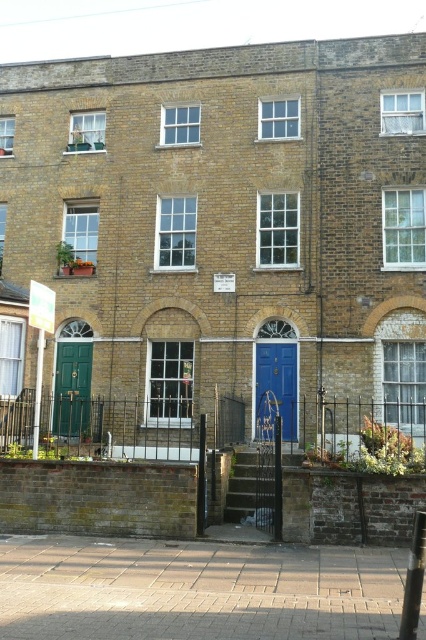
Can you confirm if green matte door at center-left is thinner than blue glossy door at center?

Yes.

Image resolution: width=426 pixels, height=640 pixels. What do you see at coordinates (71, 387) in the screenshot? I see `green matte door at center-left` at bounding box center [71, 387].

You are a GUI agent. You are given a task and a screenshot of the screen. Output one action in this format:
    pyautogui.click(x=<x>, y=<y>)
    Task: Click on the green matte door at center-left
    
    Given the screenshot: What is the action you would take?
    pyautogui.click(x=71, y=387)